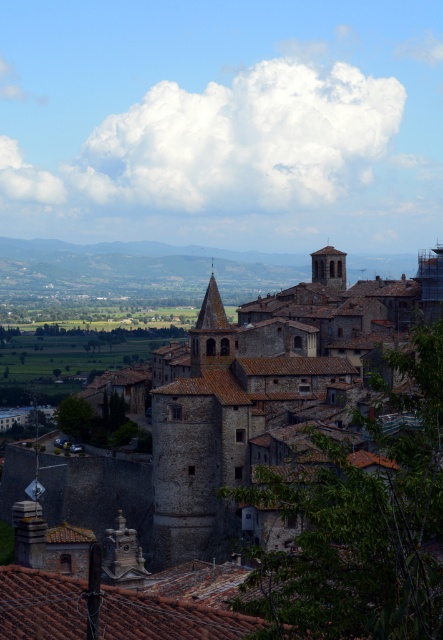
You are an architect visiting this historic town and want to take a photo of both the brown stone tower at center and the smooth stone tower at upper right. Which tower should you focus on first to ensure both are in frame?

You should focus on the brown stone tower at center first because it is located below the smooth stone tower at upper right, so positioning the camera to include both would require framing from the lower to upper part of the scene.

You are a tourist standing in the valley below the historic town. You notice two towers in the scene. Which one is taller between the brown stone tower at center and the smooth stone tower at upper right?

The brown stone tower at center is taller than the smooth stone tower at upper right.

You are a tourist standing in the valley below the historic town. You want to take a photo that includes both the brown stone tower at center and the smooth stone tower at upper right. Given their distance apart, will both towers fit in your camera frame if your camera has a 50mm lens? Assume the camera sensor size is standard and the field of view for a 50mm lens at this distance is approximately 60 degrees.

The brown stone tower at center is 154.99 feet away from the smooth stone tower at upper right. With a 50mm lens providing a 60 degree field of view, the maximum distance covered in the frame would be approximately 150 feet. Since the towers are 154.99 feet apart, they are slightly beyond the camera frame. Adjust your position closer or use a wider lens to capture both.